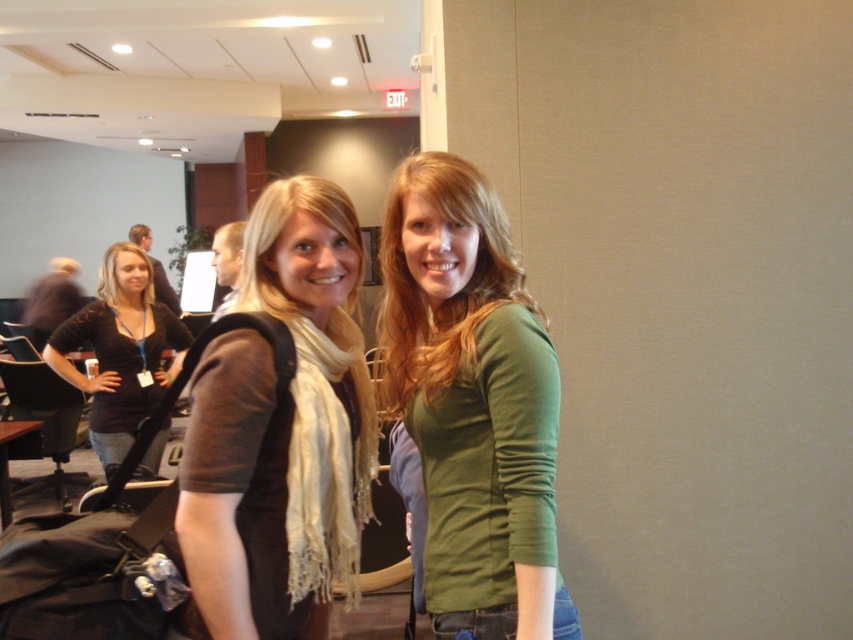
Does matte brown scarf at center have a lesser height compared to black fabric shirt at left?

Correct, matte brown scarf at center is not as tall as black fabric shirt at left.

The image size is (853, 640). What do you see at coordinates (282, 429) in the screenshot? I see `matte brown scarf at center` at bounding box center [282, 429].

Who is more distant from viewer, (305, 524) or (137, 289)?

The point (137, 289) is behind.

Find the location of a particular element. The height and width of the screenshot is (640, 853). matte brown scarf at center is located at coordinates (282, 429).

Between green matte long-sleeve shirt at center and matte brown scarf at center, which one has more height?

matte brown scarf at center

Who is shorter, green matte long-sleeve shirt at center or matte brown scarf at center?

green matte long-sleeve shirt at center

Does point (466, 273) lie behind point (334, 314)?

That is False.

You are a GUI agent. You are given a task and a screenshot of the screen. Output one action in this format:
    pyautogui.click(x=<x>, y=<y>)
    Task: Click on the green matte long-sleeve shirt at center
    
    Given the screenshot: What is the action you would take?
    pyautogui.click(x=473, y=404)

Does point (548, 401) come closer to viewer compared to point (61, 340)?

Yes, point (548, 401) is in front of point (61, 340).

Between green matte long-sleeve shirt at center and black fabric shirt at left, which one appears on the left side from the viewer's perspective?

black fabric shirt at left is more to the left.

Who is more distant from viewer, (550, 483) or (120, 412)?

The point (120, 412) is behind.

Where is `green matte long-sleeve shirt at center`? This screenshot has height=640, width=853. green matte long-sleeve shirt at center is located at coordinates coord(473,404).